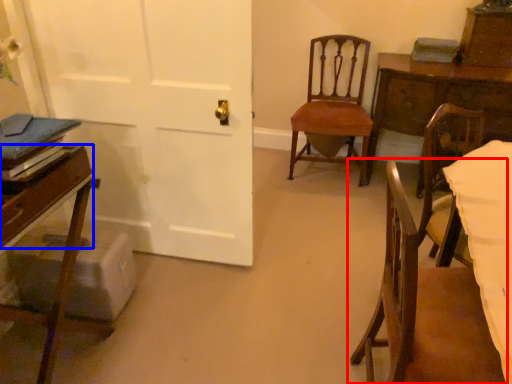
Question: Which object is further to the camera taking this photo, chair (highlighted by a red box) or drawer (highlighted by a blue box)?

Choices:
 (A) chair
 (B) drawer

Answer: (B)